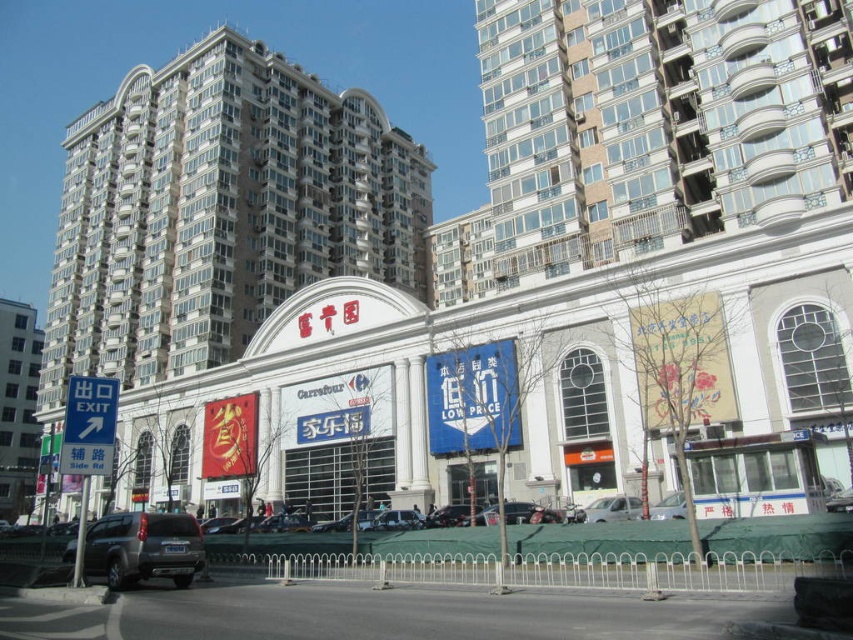
Question: Is silver metallic car at lower center to the right of metallic silver sedan at center from the viewer's perspective?

Choices:
 (A) no
 (B) yes

Answer: (B)

Question: Considering the real-world distances, which object is closest to the silver metallic car at lower center?

Choices:
 (A) silver metallic sedan at lower center
 (B) metallic silver car at center
 (C) white glossy building at center

Answer: (A)

Question: Which point is closer to the camera taking this photo?

Choices:
 (A) (131, 529)
 (B) (682, 515)
 (C) (634, 508)
 (D) (509, 513)

Answer: (A)

Question: Considering the relative positions of silver metallic car at lower center and metallic silver sedan at center in the image provided, where is silver metallic car at lower center located with respect to metallic silver sedan at center?

Choices:
 (A) above
 (B) below

Answer: (A)

Question: Which object is positioned closest to the silver metallic car at lower center?

Choices:
 (A) metallic silver sedan at center
 (B) white glossy building at center
 (C) metallic silver car at center
 (D) dark gray matte suv at lower left

Answer: (C)

Question: Does white glossy building at center appear under silver metallic car at lower center?

Choices:
 (A) no
 (B) yes

Answer: (A)